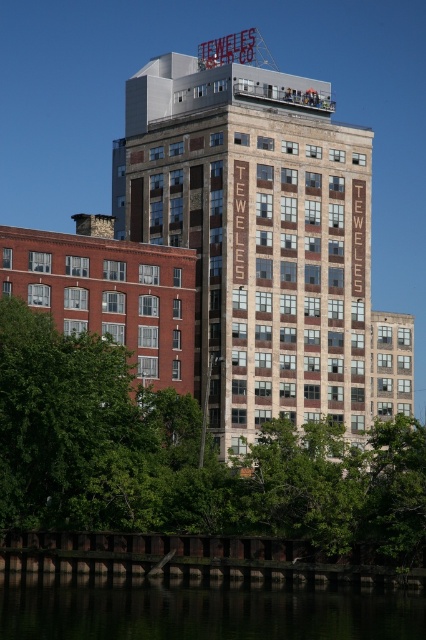
You are standing at the base of the building and want to take a photo of the green leafy tree at lower left. If you need to be within 200 feet to get a clear shot, can you take the photo from where you are?

The green leafy tree at lower left is 190.61 feet away from the camera, which is within the 200 feet range, so yes, you can take a clear photo from your current position.

You are standing at the point marked as point (187, 458) in the image. Looking towards the building, which direction should you turn to face the green leafy tree at lower left?

The point (187, 458) is located at the green leafy tree at lower left, so you are already facing it.